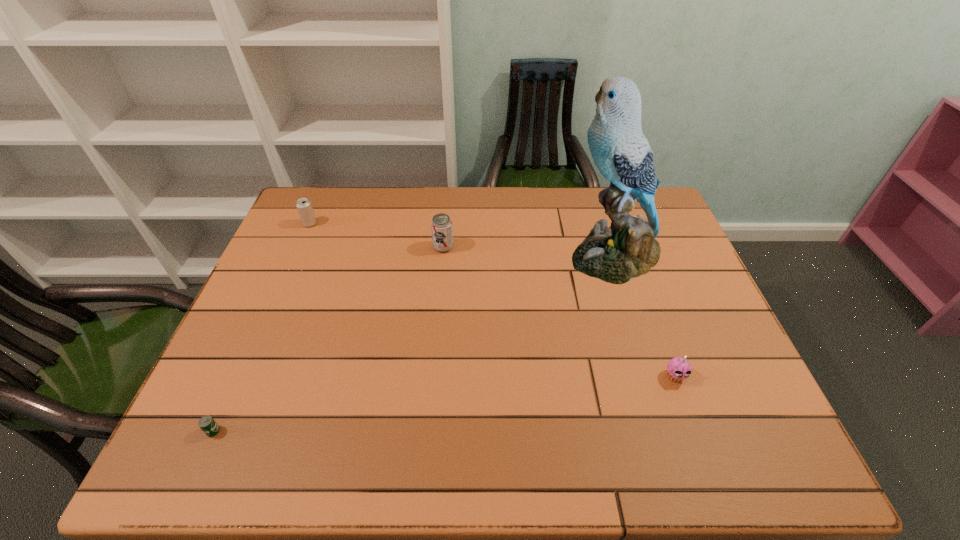
Locate an element on the screen. Image resolution: width=960 pixels, height=540 pixels. empty location between the second tallest object and the farthest object is located at coordinates (376, 235).

I want to click on vacant area between the nearest beer can and the third object from right to left, so click(328, 339).

Locate an element on the screen. The image size is (960, 540). vacant space in between the second nearest object and the nearest beer can is located at coordinates (444, 403).

What are the coordinates of `free space between the cupcake and the parakeet` in the screenshot? It's located at (644, 316).

The width and height of the screenshot is (960, 540). I want to click on free space that is in between the nearest beer can and the tallest object, so click(414, 343).

The height and width of the screenshot is (540, 960). Find the location of `free space between the farthest object and the tallest object`. free space between the farthest object and the tallest object is located at coordinates (462, 240).

Where is `vacant space in between the parakeet and the second shortest beer can`? This screenshot has height=540, width=960. vacant space in between the parakeet and the second shortest beer can is located at coordinates (462, 240).

What are the coordinates of `free space between the second nearest object and the third object from right to left` in the screenshot? It's located at (559, 312).

Find the location of a particular element. object that stands as the fourth closest to the nearest beer can is located at coordinates (678, 369).

Locate an element on the screen. The width and height of the screenshot is (960, 540). the closest object to the second nearest object is located at coordinates (627, 249).